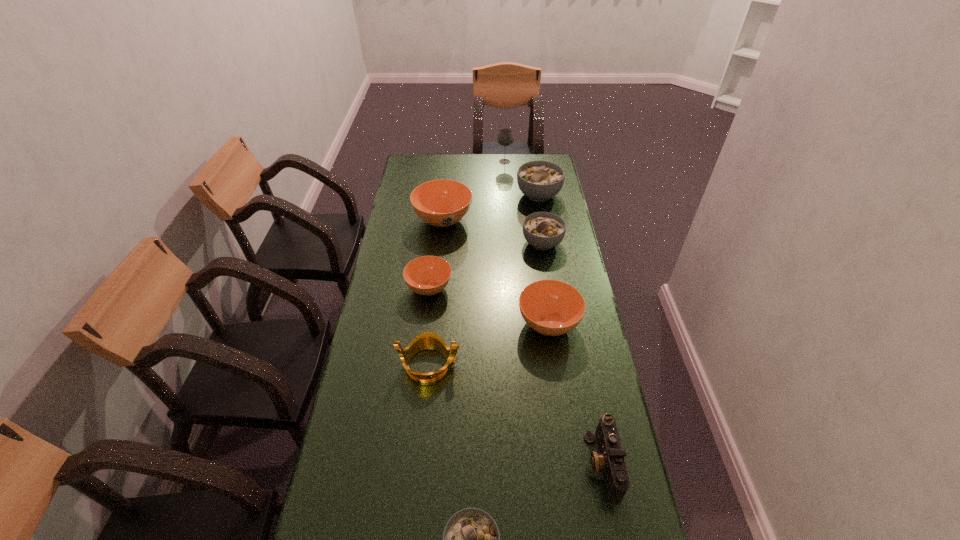
Find the location of a particular element. vacant area that lies between the rightmost peach soup bowl and the farthest object is located at coordinates (527, 242).

What are the coordinates of `blank region between the rightmost peach soup bowl and the smallest peach soup bowl` in the screenshot? It's located at coord(489,306).

In order to click on object that is the closest one to the biggest peach soup bowl in this screenshot , I will do `click(539, 180)`.

This screenshot has width=960, height=540. I want to click on object that stands as the closest to the second biggest white soup bowl, so click(x=539, y=180).

This screenshot has width=960, height=540. Identify the location of the closest soup bowl to the camera. coord(471,539).

The height and width of the screenshot is (540, 960). What are the coordinates of `soup bowl identified as the closest to the rightmost peach soup bowl` in the screenshot? It's located at (428, 275).

Identify which white soup bowl is the third closest to the gray wineglass. Please provide its 2D coordinates. Your answer should be formatted as a tuple, i.e. [(x, y)], where the tuple contains the x and y coordinates of a point satisfying the conditions above.

[(471, 539)]

This screenshot has height=540, width=960. What are the coordinates of `the closest white soup bowl to the smallest peach soup bowl` in the screenshot? It's located at (543, 230).

Where is `the third closest peach soup bowl relative to the smallest white soup bowl`? the third closest peach soup bowl relative to the smallest white soup bowl is located at coordinates (441, 203).

Locate an element on the screen. peach soup bowl identified as the second closest to the smallest peach soup bowl is located at coordinates (550, 307).